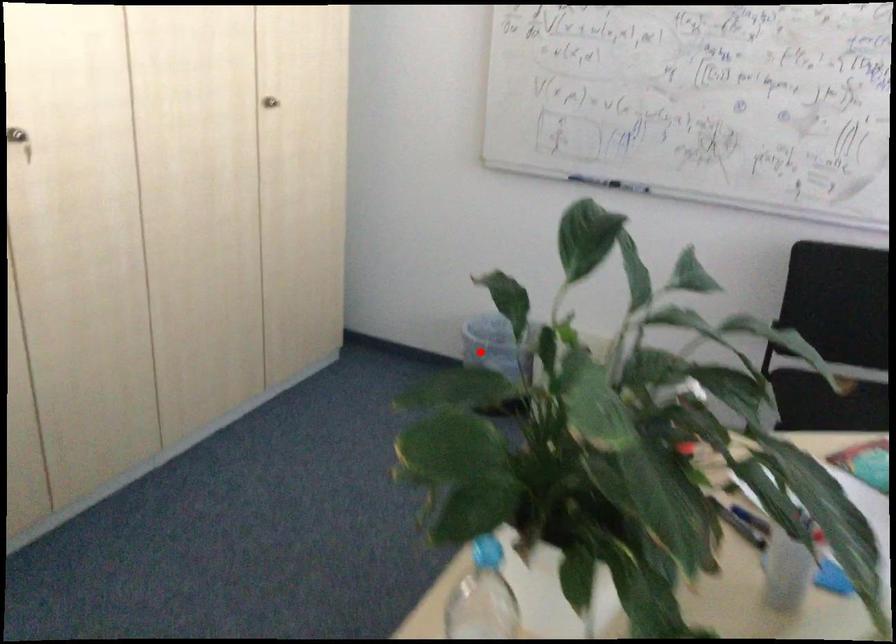
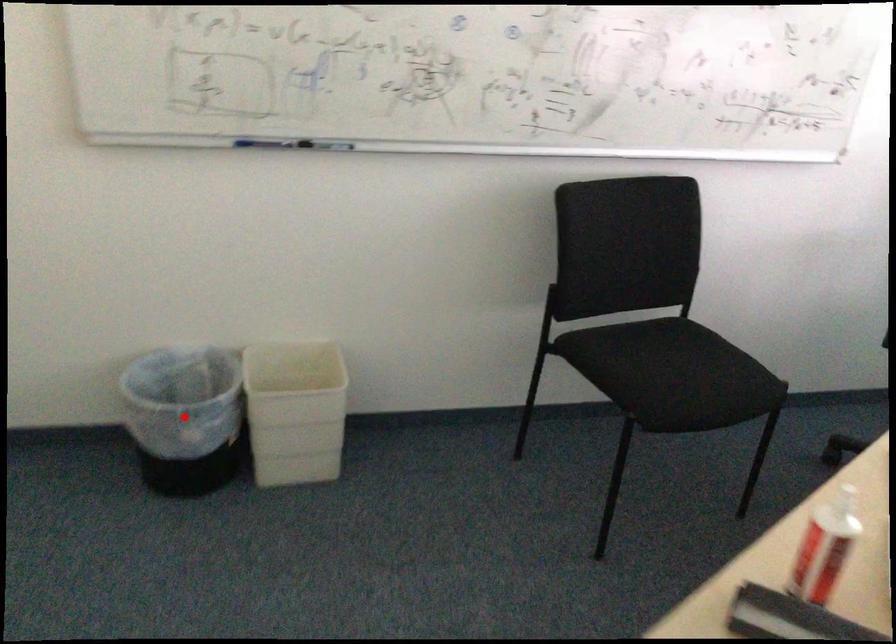
I am providing you with two images of the same scene from different viewpoints. A red point is marked on the first image and another point is marked on the second image. Do the highlighted points in image1 and image2 indicate the same real-world spot?

Yes